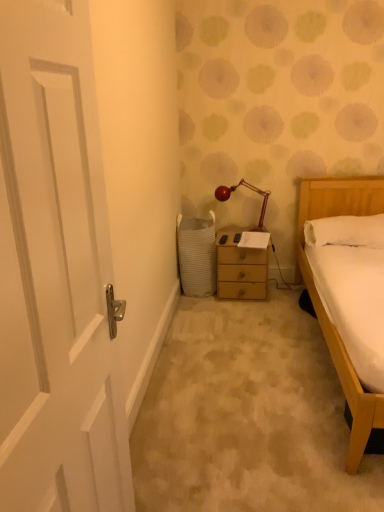
Question: Should I look upward or downward to see white glossy door at left?

Choices:
 (A) down
 (B) up

Answer: (A)

Question: Is the position of wooden nightstand at center less distant than that of white soft pillow at right?

Choices:
 (A) no
 (B) yes

Answer: (A)

Question: Can you confirm if wooden nightstand at center is positioned to the right of white soft pillow at right?

Choices:
 (A) yes
 (B) no

Answer: (B)

Question: From the image's perspective, is wooden nightstand at center on top of white soft pillow at right?

Choices:
 (A) no
 (B) yes

Answer: (A)

Question: Are wooden nightstand at center and white soft pillow at right making contact?

Choices:
 (A) no
 (B) yes

Answer: (A)

Question: Does wooden nightstand at center have a greater height compared to white soft pillow at right?

Choices:
 (A) no
 (B) yes

Answer: (B)

Question: From a real-world perspective, does wooden nightstand at center stand above white soft pillow at right?

Choices:
 (A) no
 (B) yes

Answer: (A)

Question: Considering the relative positions of metallic red lamp at center and white soft pillow at right in the image provided, is metallic red lamp at center to the left of white soft pillow at right from the viewer's perspective?

Choices:
 (A) yes
 (B) no

Answer: (A)

Question: Is white soft pillow at right a part of metallic red lamp at center?

Choices:
 (A) no
 (B) yes

Answer: (A)

Question: Is metallic red lamp at center positioned with its back to white soft pillow at right?

Choices:
 (A) no
 (B) yes

Answer: (A)

Question: From the image's perspective, would you say metallic red lamp at center is shown under white soft pillow at right?

Choices:
 (A) yes
 (B) no

Answer: (B)

Question: Is metallic red lamp at center further to the viewer compared to white soft pillow at right?

Choices:
 (A) no
 (B) yes

Answer: (B)

Question: Is metallic red lamp at center to the right of white soft pillow at right from the viewer's perspective?

Choices:
 (A) no
 (B) yes

Answer: (A)

Question: Can you confirm if white glossy door at left is shorter than white soft pillow at right?

Choices:
 (A) yes
 (B) no

Answer: (B)